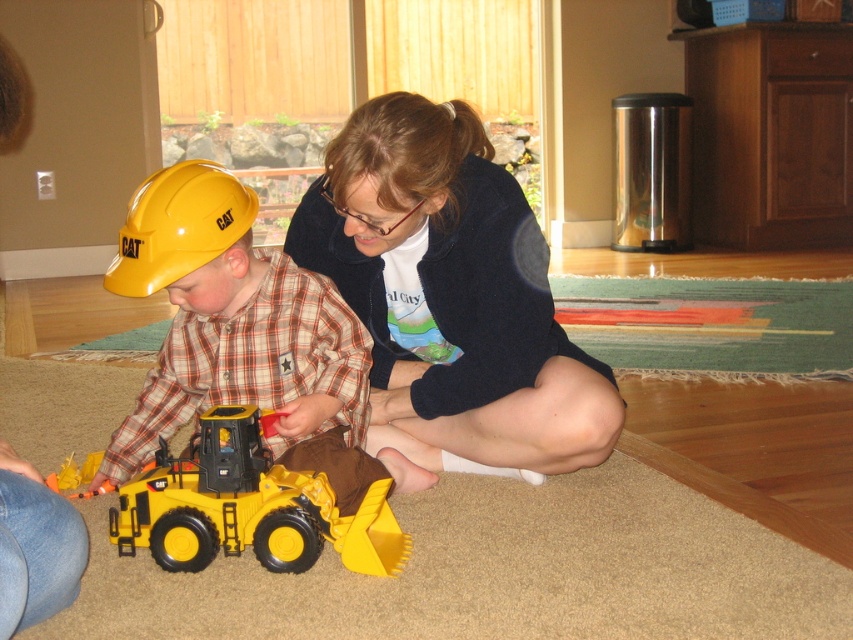
Question: Based on their relative distances, which object is nearer to the matte blue sweater at center?

Choices:
 (A) yellow hard hat at left
 (B) matte yellow construction helmet at left

Answer: (B)

Question: Does matte blue sweater at center have a lesser width compared to yellow hard hat at left?

Choices:
 (A) no
 (B) yes

Answer: (A)

Question: Which of the following is the closest to the observer?

Choices:
 (A) (190, 257)
 (B) (556, 442)
 (C) (283, 374)
 (D) (128, 506)

Answer: (A)

Question: Can you confirm if matte yellow construction helmet at left is positioned to the left of yellow plastic toy at center?

Choices:
 (A) yes
 (B) no

Answer: (A)

Question: Does matte blue sweater at center appear on the left side of yellow plastic toy at center?

Choices:
 (A) no
 (B) yes

Answer: (A)

Question: Which of the following is the closest to the observer?

Choices:
 (A) matte blue sweater at center
 (B) matte yellow construction helmet at left
 (C) yellow plastic toy at center
 (D) yellow hard hat at left

Answer: (A)